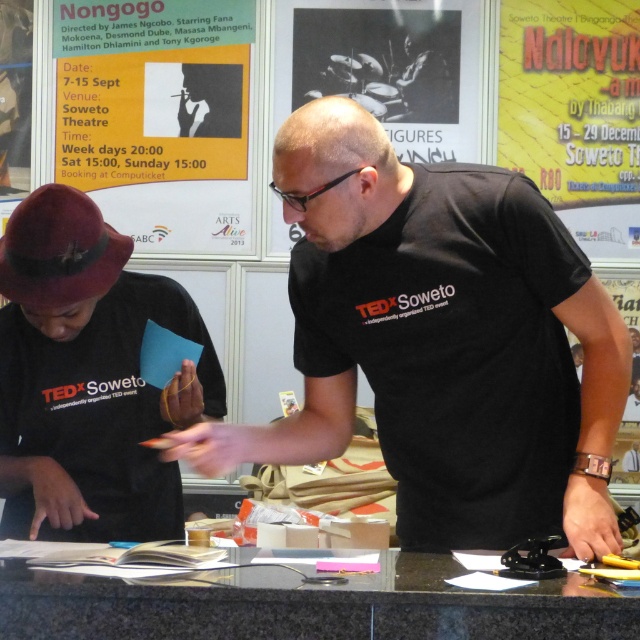
You are standing in front of the granite table at center and want to hang the yellow paper poster at upper center on the wall behind it. Can you reach the poster from your current position?

The granite table at center is closer to the viewer than the yellow paper poster at upper center, so you cannot reach the poster from your current position because it is further away.